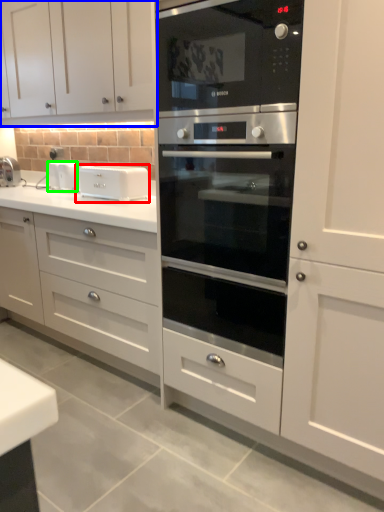
Question: Considering the real-world distances, which object is farthest from appliance (highlighted by a red box)? cabinetry (highlighted by a blue box) or appliance (highlighted by a green box)?

Choices:
 (A) cabinetry
 (B) appliance

Answer: (A)